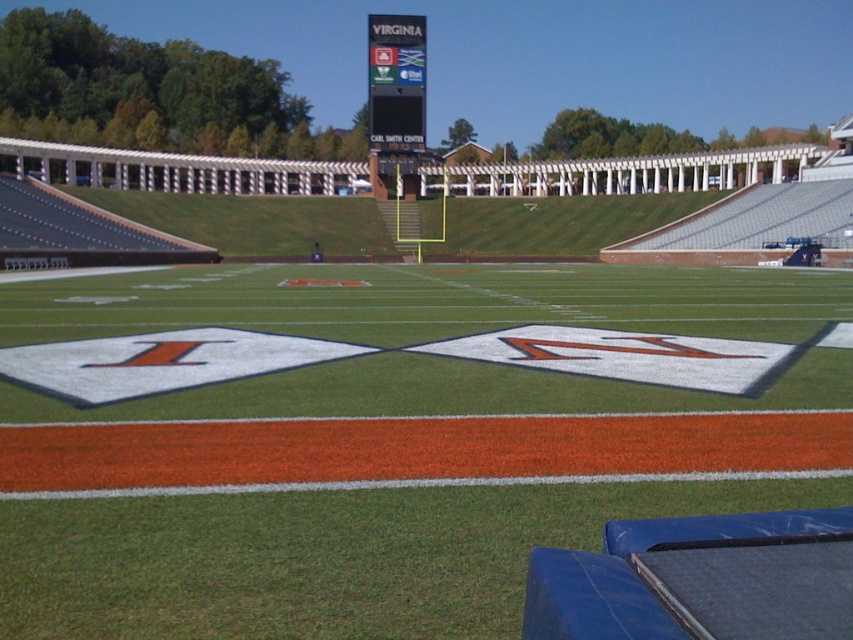
Does green artificial turf at center appear on the left side of black digital scoreboard at upper center?

Incorrect, green artificial turf at center is not on the left side of black digital scoreboard at upper center.

The width and height of the screenshot is (853, 640). What do you see at coordinates (387, 435) in the screenshot?
I see `green artificial turf at center` at bounding box center [387, 435].

Locate an element on the screen. green artificial turf at center is located at coordinates (387, 435).